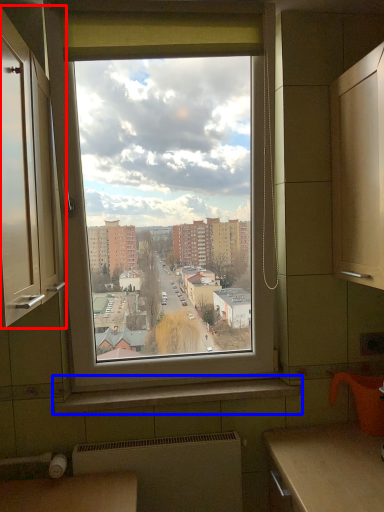
Question: Which object is further to the camera taking this photo, cabinetry (highlighted by a red box) or window sill (highlighted by a blue box)?

Choices:
 (A) cabinetry
 (B) window sill

Answer: (B)